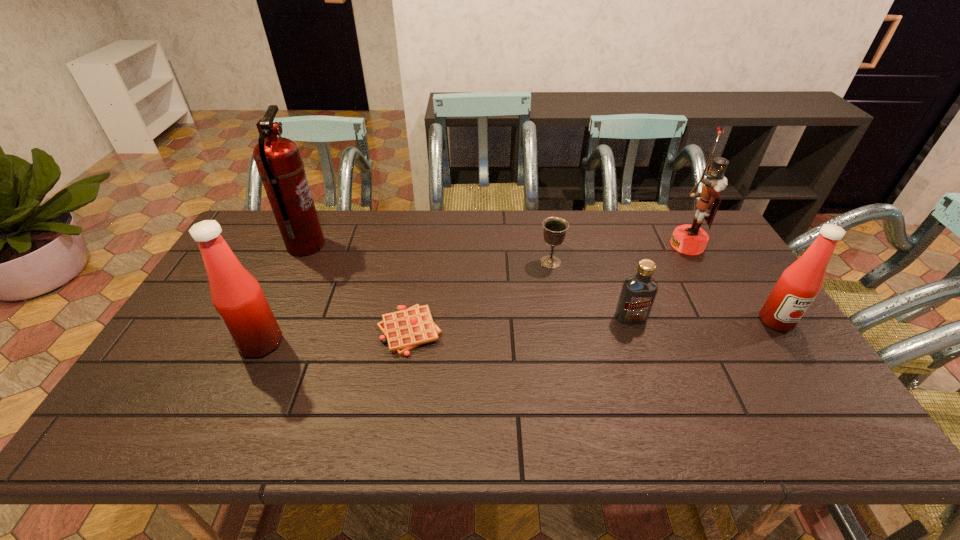
The image size is (960, 540). In order to click on the left condiment in this screenshot , I will do `click(236, 295)`.

Image resolution: width=960 pixels, height=540 pixels. Find the location of `the fourth shortest object`. the fourth shortest object is located at coordinates (799, 284).

At what (x,y) coordinates should I click in order to perform the action: click on the rightmost object. Please return your answer as a coordinate pair (x, y). The width and height of the screenshot is (960, 540). Looking at the image, I should click on (799, 284).

In order to click on the sixth object from left to right in this screenshot , I will do `click(688, 239)`.

This screenshot has width=960, height=540. In order to click on fire extinguisher in this screenshot , I will do `click(278, 160)`.

Identify the location of waffle. (405, 329).

Locate an element on the screen. The width and height of the screenshot is (960, 540). the shortest object is located at coordinates (405, 329).

Where is `the second shortest object`? This screenshot has height=540, width=960. the second shortest object is located at coordinates pyautogui.click(x=555, y=228).

Where is `the fourth object from right to left`? This screenshot has height=540, width=960. the fourth object from right to left is located at coordinates (x=555, y=228).

Find the location of `the third shortest object`. the third shortest object is located at coordinates (638, 293).